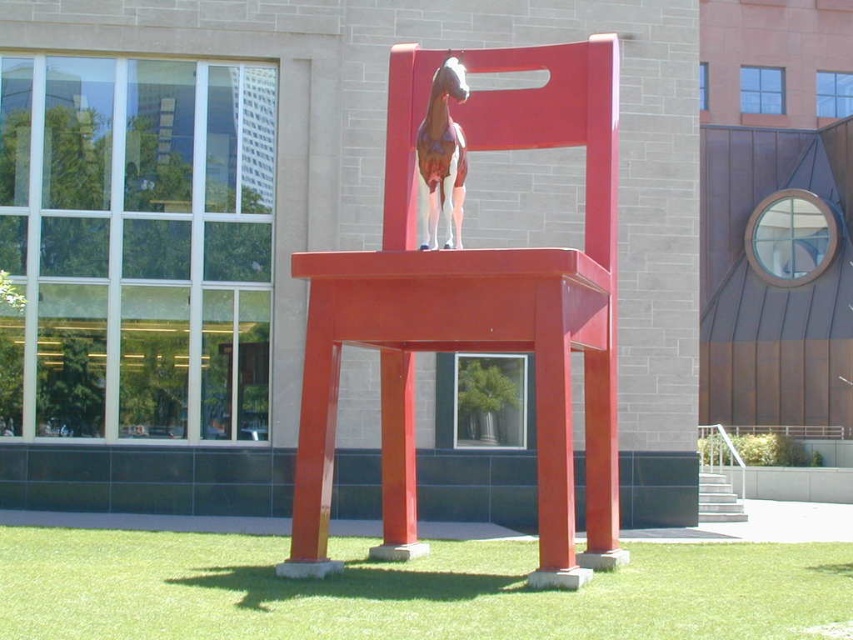
You are standing at the center of the plaza and want to place a new sculpture exactly where the matte red chair at center is currently located. According to the provided coordinates, is the chair already positioned at the plaza center? Please explain.

The matte red chair at center is located at point (477,310), which is very close to the plaza center coordinates of (426,320). Therefore, the chair is already positioned near the plaza center.

You are a maintenance worker who needs to clean the matte red chair at center. You have a 2 meter long pole. Can you reach the chair from the green grass at lower center without moving the pole?

The distance between the matte red chair at center and the green grass at lower center is 2.08 meters. Since the pole is only 2 meters long, it is 8 centimeters too short to reach the chair from the grass without moving the pole.